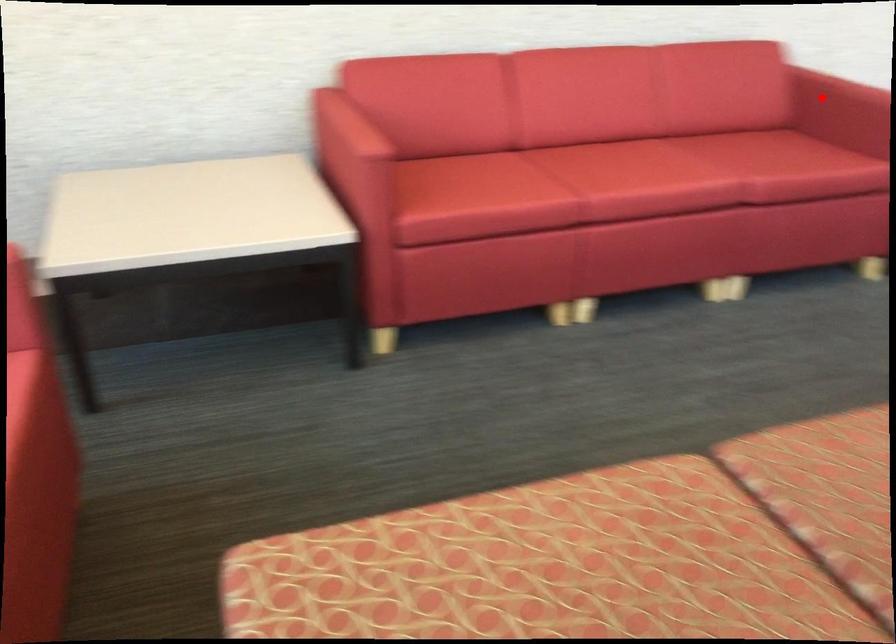
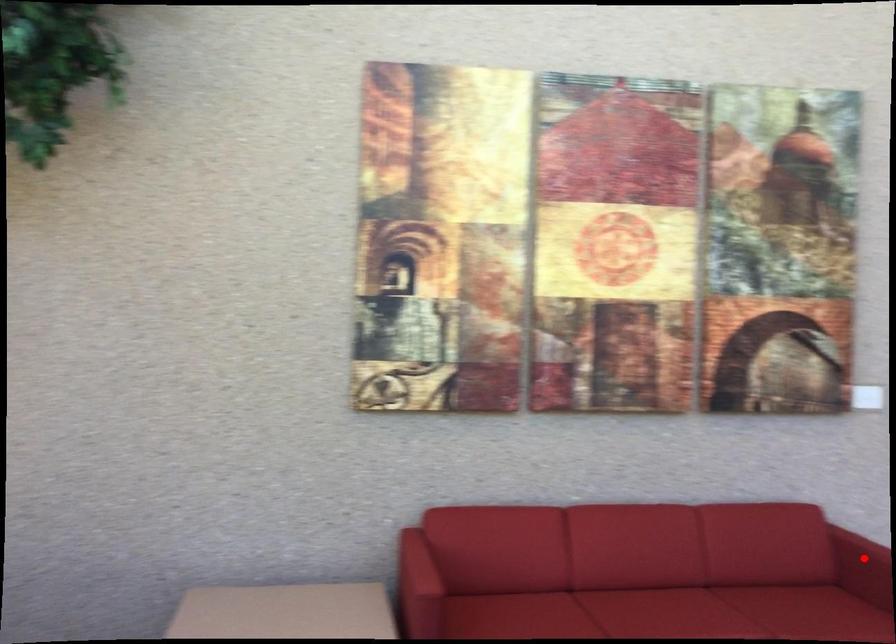
I am providing you with two images of the same scene from different viewpoints. A red point is marked on the first image and another point is marked on the second image. Is the red point in image1 aligned with the point shown in image2?

Yes